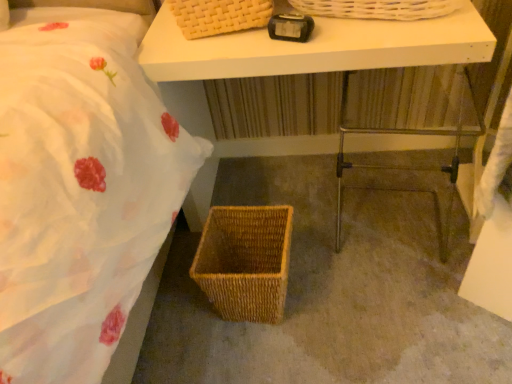
The width and height of the screenshot is (512, 384). In order to click on vacant area in front of white matte table at upper center in this screenshot , I will do `click(346, 312)`.